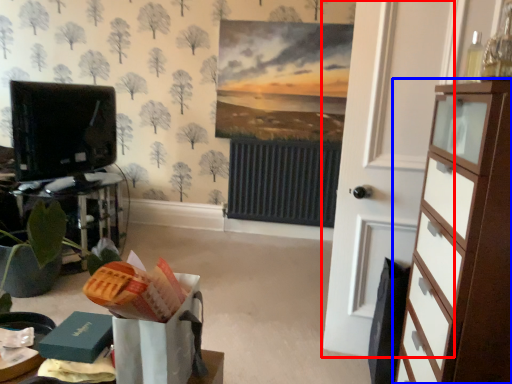
Question: Which object is closer to the camera taking this photo, door (highlighted by a red box) or chest of drawers (highlighted by a blue box)?

Choices:
 (A) door
 (B) chest of drawers

Answer: (B)